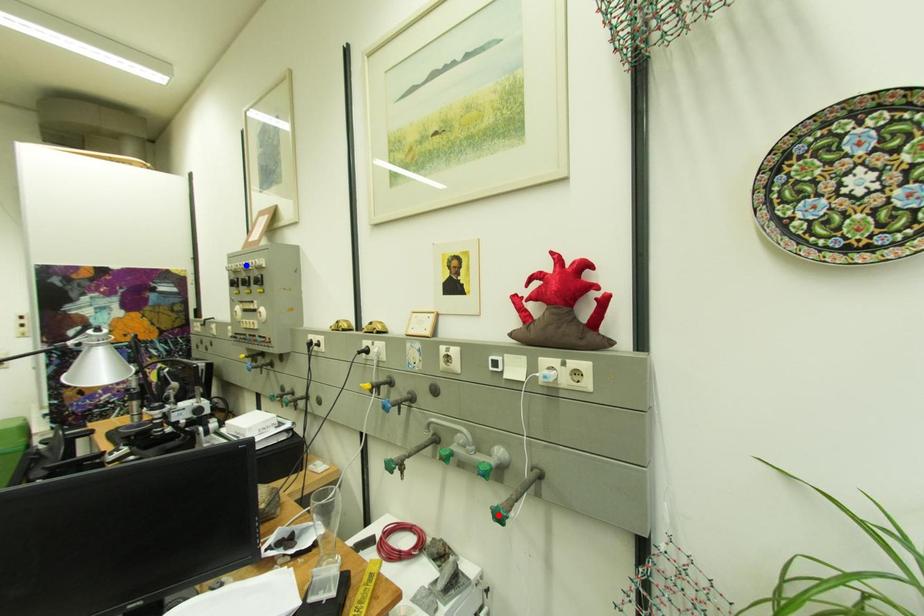
Question: Two points are marked on the image. Which point is closer to the camera?

Choices:
 (A) Blue point is closer.
 (B) Red point is closer.

Answer: (B)